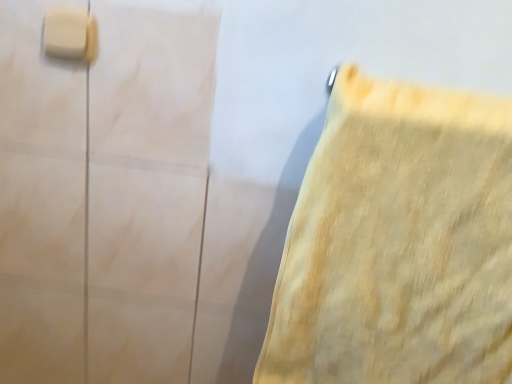
Question: From the image's perspective, is white matte/light switch at upper left beneath yellow fabric towel at right?

Choices:
 (A) no
 (B) yes

Answer: (A)

Question: From a real-world perspective, is white matte/light switch at upper left positioned over yellow fabric towel at right based on gravity?

Choices:
 (A) yes
 (B) no

Answer: (A)

Question: Can you confirm if white matte/light switch at upper left is thinner than yellow fabric towel at right?

Choices:
 (A) no
 (B) yes

Answer: (B)

Question: Is white matte/light switch at upper left bigger than yellow fabric towel at right?

Choices:
 (A) no
 (B) yes

Answer: (A)

Question: Considering the relative sizes of white matte/light switch at upper left and yellow fabric towel at right in the image provided, is white matte/light switch at upper left smaller than yellow fabric towel at right?

Choices:
 (A) no
 (B) yes

Answer: (B)

Question: Is yellow fabric towel at right a part of white matte/light switch at upper left?

Choices:
 (A) no
 (B) yes

Answer: (A)

Question: Is yellow fabric towel at right further to camera compared to white matte/light switch at upper left?

Choices:
 (A) no
 (B) yes

Answer: (A)

Question: Can you see yellow fabric towel at right touching white matte/light switch at upper left?

Choices:
 (A) no
 (B) yes

Answer: (A)

Question: Can you confirm if yellow fabric towel at right is positioned to the left of white matte/light switch at upper left?

Choices:
 (A) no
 (B) yes

Answer: (A)

Question: Can you confirm if yellow fabric towel at right is shorter than white matte/light switch at upper left?

Choices:
 (A) no
 (B) yes

Answer: (A)

Question: From a real-world perspective, is yellow fabric towel at right below white matte/light switch at upper left?

Choices:
 (A) yes
 (B) no

Answer: (A)

Question: From the image's perspective, would you say yellow fabric towel at right is shown under white matte/light switch at upper left?

Choices:
 (A) no
 (B) yes

Answer: (B)

Question: From a real-world perspective, is yellow fabric towel at right physically located above or below white matte/light switch at upper left?

Choices:
 (A) above
 (B) below

Answer: (B)